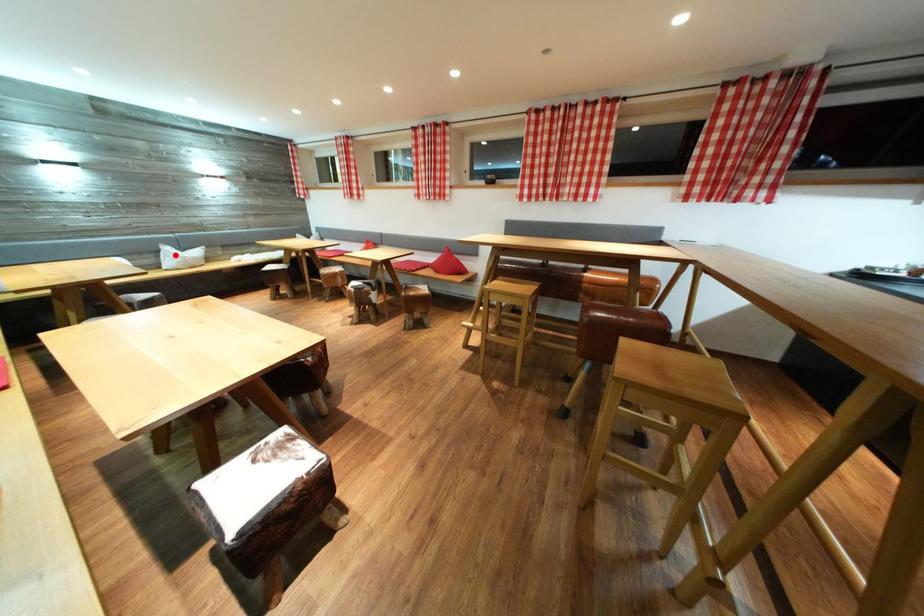
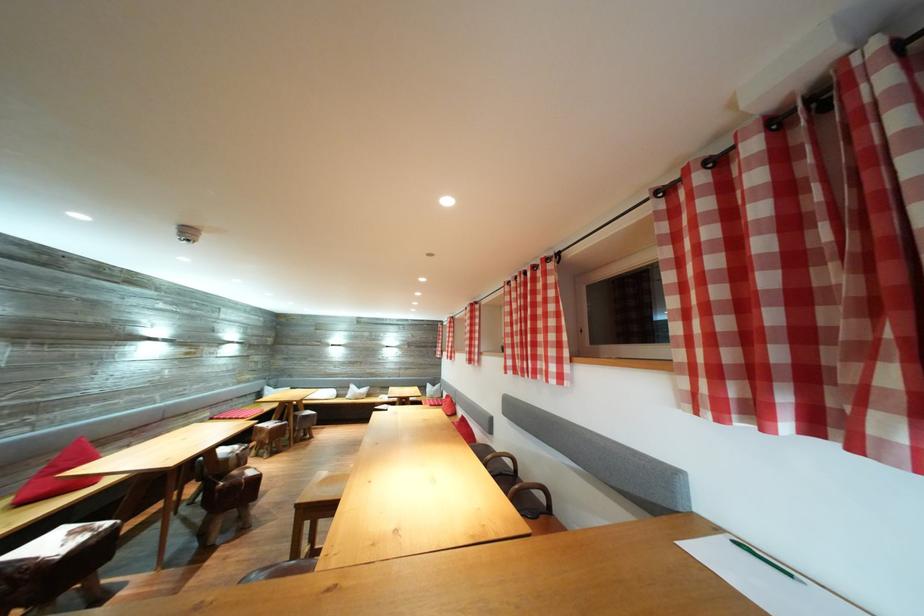
Question: I am providing you with two images of the same scene from different viewpoints. Given a red point in image1, look at the same physical point in image2. Is it:

Choices:
 (A) Closer to the viewpoint
 (B) Farther from the viewpoint

Answer: (B)